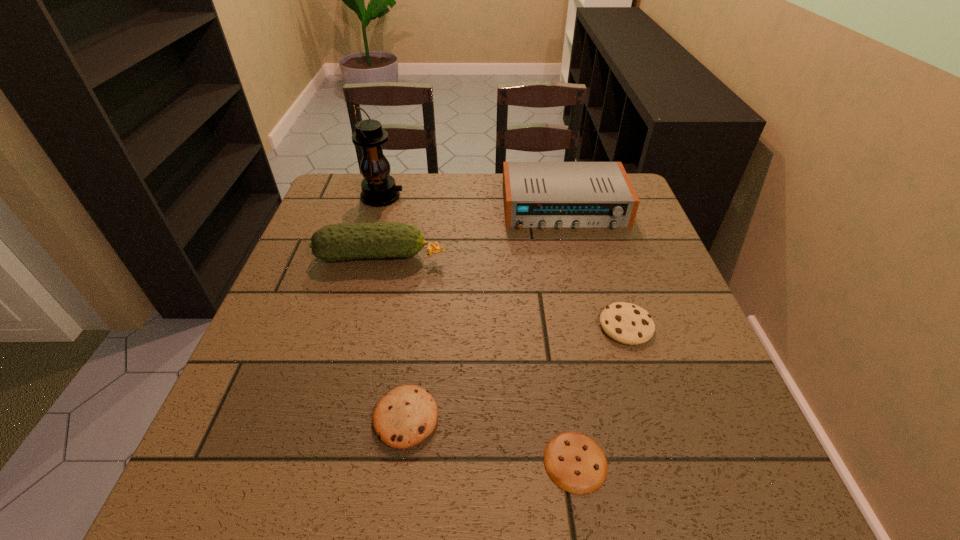
Identify which object is the third nearest to the third nearest object. Please provide its 2D coordinates. Your answer should be formatted as a tuple, i.e. [(x, y)], where the tuple contains the x and y coordinates of a point satisfying the conditions above.

[(407, 415)]

Image resolution: width=960 pixels, height=540 pixels. In order to click on cookie that is the third closest to the third farthest object in this screenshot , I will do `click(574, 462)`.

The height and width of the screenshot is (540, 960). I want to click on cookie that can be found as the second closest to the second shortest cookie, so click(626, 323).

Identify the location of vacant area that satisfies the following two spatial constraints: 1. at the blossom end of the fourth nearest object; 2. on the left side of the shortest cookie. Image resolution: width=960 pixels, height=540 pixels. (329, 462).

Find the location of a particular element. vacant region that satisfies the following two spatial constraints: 1. on the front panel of the radio receiver; 2. at the blossom end of the third farthest object is located at coordinates (576, 257).

I want to click on free region that satisfies the following two spatial constraints: 1. at the blossom end of the fourth nearest object; 2. on the left side of the shortest cookie, so click(x=329, y=462).

This screenshot has width=960, height=540. What are the coordinates of `vacant region that satisfies the following two spatial constraints: 1. above the second cookie from right to left, indicating its light source; 2. on the left side of the lantern` in the screenshot? It's located at (304, 462).

Where is `vacant space that satisfies the following two spatial constraints: 1. at the blossom end of the third farthest object; 2. on the back side of the leftmost cookie`? The width and height of the screenshot is (960, 540). vacant space that satisfies the following two spatial constraints: 1. at the blossom end of the third farthest object; 2. on the back side of the leftmost cookie is located at coordinates (340, 417).

Locate an element on the screen. free space that satisfies the following two spatial constraints: 1. at the blossom end of the fourth nearest object; 2. on the back side of the farthest cookie is located at coordinates (363, 326).

You are a GUI agent. You are given a task and a screenshot of the screen. Output one action in this format:
    pyautogui.click(x=<x>, y=<y>)
    Task: Click on the free space that satisfies the following two spatial constraints: 1. above the lantern, indicating its light source; 2. on the left side of the shortest object
    This screenshot has height=540, width=960.
    Given the screenshot: What is the action you would take?
    (304, 462)